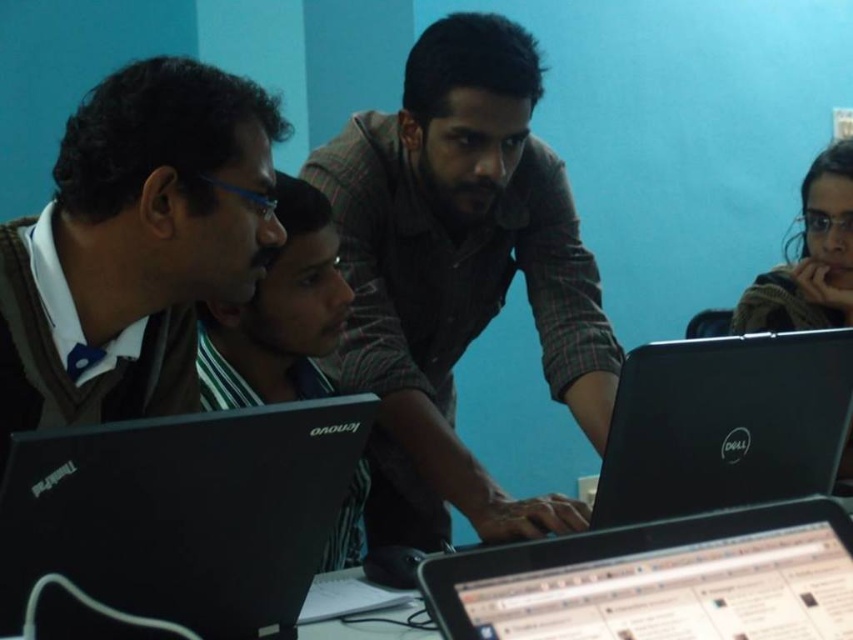
Can you confirm if black glossy laptop at center is bigger than black striped shirt at center?

Actually, black glossy laptop at center might be smaller than black striped shirt at center.

Which is below, black glossy laptop at center or black striped shirt at center?

black glossy laptop at center

The image size is (853, 640). What are the coordinates of `black glossy laptop at center` in the screenshot? It's located at (659, 579).

Where is `black glossy laptop at center`? The height and width of the screenshot is (640, 853). black glossy laptop at center is located at coordinates (659, 579).

Does black striped shirt at center appear on the right side of dark brown sweater at upper right?

In fact, black striped shirt at center is to the left of dark brown sweater at upper right.

Is point (334, 566) closer to viewer compared to point (758, 323)?

Yes, point (334, 566) is closer to viewer.

In order to click on black striped shirt at center in this screenshot , I will do `click(279, 314)`.

Consider the image. Is plaid shirt at center smaller than matte brown sweater at left?

Actually, plaid shirt at center might be larger than matte brown sweater at left.

You are a GUI agent. You are given a task and a screenshot of the screen. Output one action in this format:
    pyautogui.click(x=<x>, y=<y>)
    Task: Click on the plaid shirt at center
    The image size is (853, 640).
    Given the screenshot: What is the action you would take?
    pyautogui.click(x=457, y=276)

This screenshot has height=640, width=853. I want to click on plaid shirt at center, so click(457, 276).